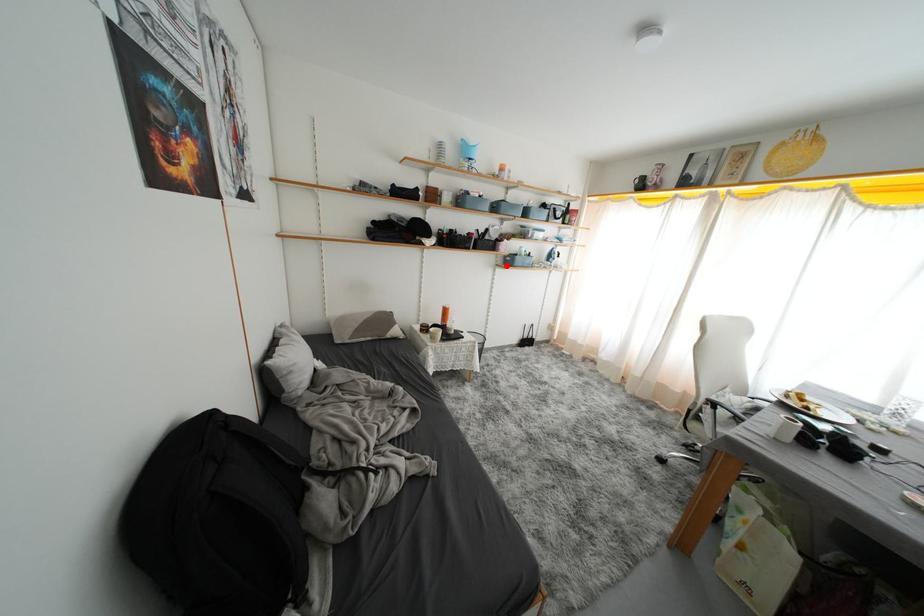
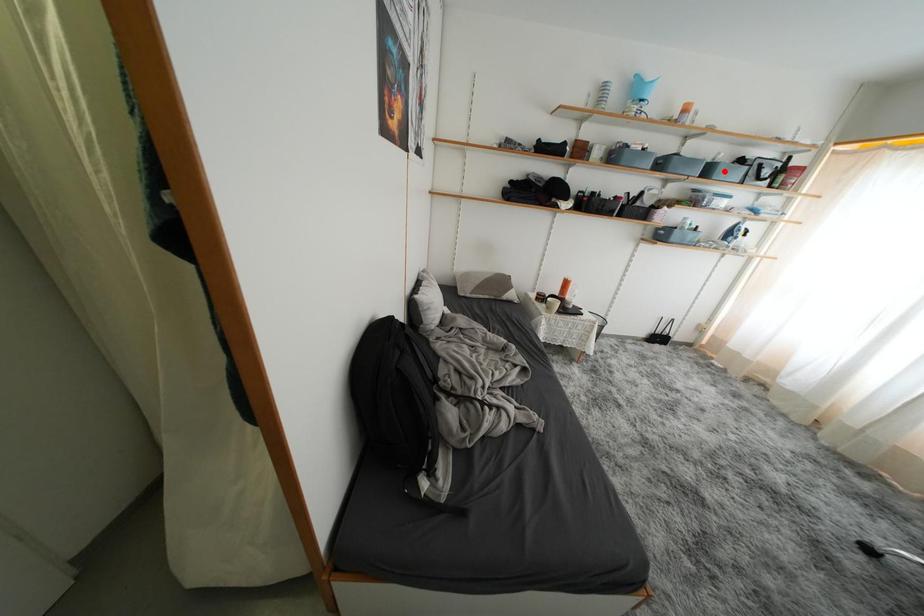
I am providing you with two images of the same scene from different viewpoints. A red point is marked on the first image and another point is marked on the second image. Is the red point in image1 aligned with the point shown in image2?

No